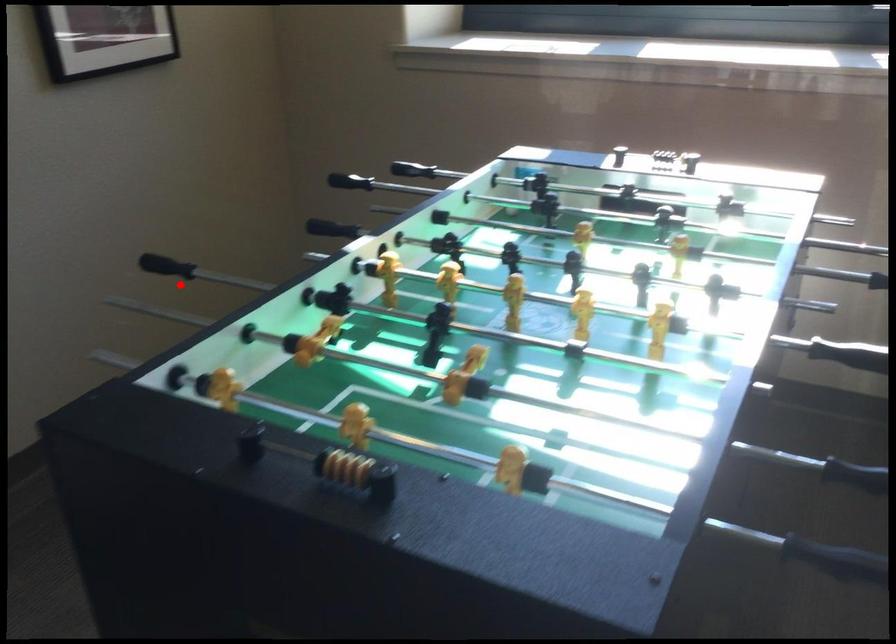
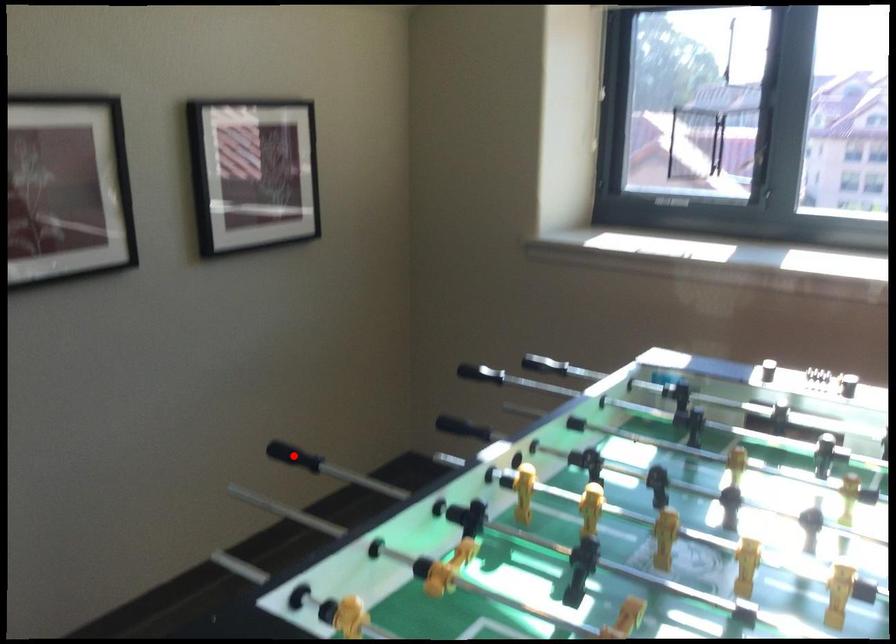
In the scene shown: I am providing you with two images of the same scene from different viewpoints. A red point is marked on the first image and another point is marked on the second image. Is the marked point in image1 the same physical position as the marked point in image2?

Yes